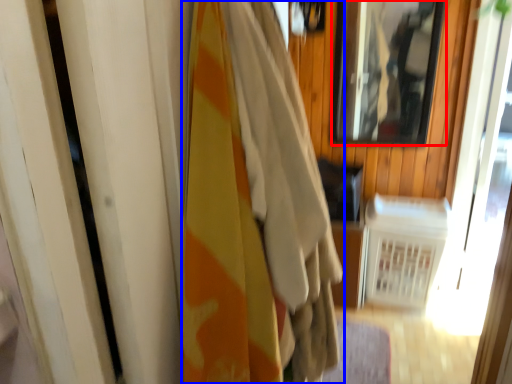
Question: Which object is closer to the camera taking this photo, mirror (highlighted by a red box) or curtain (highlighted by a blue box)?

Choices:
 (A) mirror
 (B) curtain

Answer: (B)